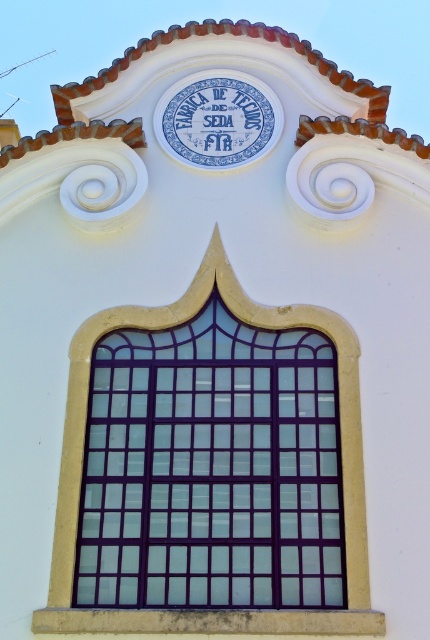
You are an architect reviewing a building facade. You notice a point at coordinate (211, 468). What does this point represent?

The point at coordinate (211, 468) represents the purple glass window at center.

You are an architect examining the building facade. You notice the purple glass window at center and the blue ceramic sign at center. Which object occupies more space on the facade?

The purple glass window at center has a larger size compared to the blue ceramic sign at center, so it occupies more space on the facade.

You are an architect examining the building facade. You need to install a new light fixture that requires a minimum of 1.5 meters of vertical space. Given the purple glass window at center and the blue ceramic sign at center, which object provides sufficient vertical space for the light fixture?

The purple glass window at center is much taller than the blue ceramic sign at center, so it provides sufficient vertical space for the light fixture requiring 1.5 meters.